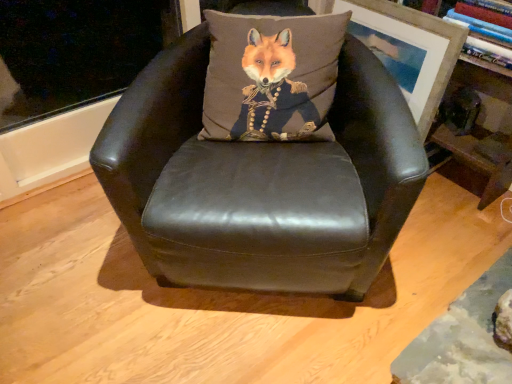
Question: Does point (475, 140) appear closer or farther from the camera than point (359, 19)?

Choices:
 (A) closer
 (B) farther

Answer: (B)

Question: Relative to wooden picture frame at upper right, is wooden bookshelf at upper right in front or behind?

Choices:
 (A) front
 (B) behind

Answer: (A)

Question: Which of these objects is positioned closest to the wooden picture frame at upper right?

Choices:
 (A) wooden bookshelf at upper right
 (B) matte black leather chair at center

Answer: (A)

Question: Estimate the real-world distances between objects in this image. Which object is closer to the wooden picture frame at upper right?

Choices:
 (A) wooden bookshelf at upper right
 (B) matte black leather chair at center

Answer: (A)